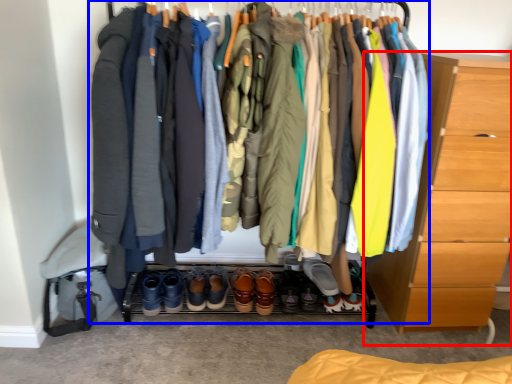
Question: Among these objects, which one is nearest to the camera, chest of drawers (highlighted by a red box) or closet (highlighted by a blue box)?

Choices:
 (A) chest of drawers
 (B) closet

Answer: (B)